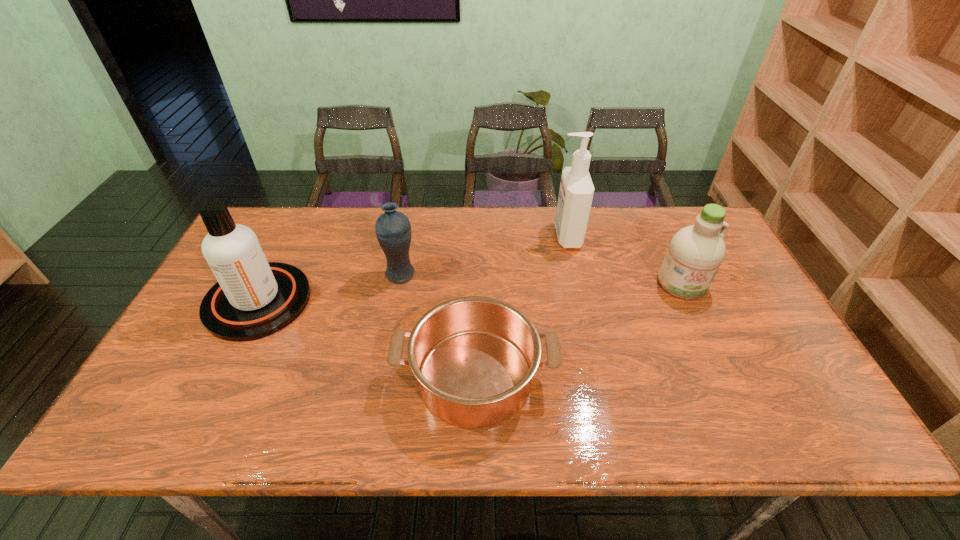
The width and height of the screenshot is (960, 540). I want to click on free space at the left edge of the desktop, so click(x=171, y=354).

The image size is (960, 540). In order to click on free spot at the right edge of the desktop in this screenshot , I will do `click(756, 303)`.

Find the location of a particular element. This screenshot has width=960, height=540. free region at the far left corner of the desktop is located at coordinates (283, 222).

This screenshot has width=960, height=540. Identify the location of vacant space at the near left corner of the desktop. (185, 442).

What are the coordinates of `blank region between the rightmost cleansing agent and the vase` in the screenshot? It's located at (541, 279).

Identify the location of empty space that is in between the rightmost cleansing agent and the farthest cleansing agent. (624, 260).

You are a GUI agent. You are given a task and a screenshot of the screen. Output one action in this format:
    pyautogui.click(x=<x>, y=<y>)
    Task: Click on the free space between the shortest cleansing agent and the saucepan
    This screenshot has height=540, width=960.
    Given the screenshot: What is the action you would take?
    pyautogui.click(x=578, y=330)

The height and width of the screenshot is (540, 960). In order to click on free area in between the farthest cleansing agent and the saucepan in this screenshot , I will do `click(521, 306)`.

You are a GUI agent. You are given a task and a screenshot of the screen. Output one action in this format:
    pyautogui.click(x=<x>, y=<y>)
    Task: Click on the vacant area that lies between the rightmost object and the leftmost cleansing agent
    
    Given the screenshot: What is the action you would take?
    pyautogui.click(x=469, y=292)

You are a GUI agent. You are given a task and a screenshot of the screen. Output one action in this format:
    pyautogui.click(x=<x>, y=<y>)
    Task: Click on the free spot between the second cleansing agent from left to right and the vase
    
    Given the screenshot: What is the action you would take?
    pyautogui.click(x=484, y=255)